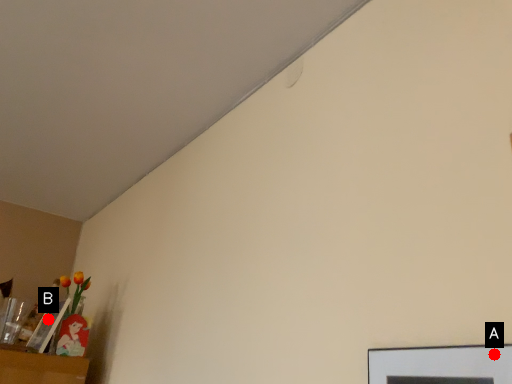
Question: Two points are circled on the image, labeled by A and B beside each circle. Which of the following is the closest to the observer?

Choices:
 (A) A is closer
 (B) B is closer

Answer: (A)